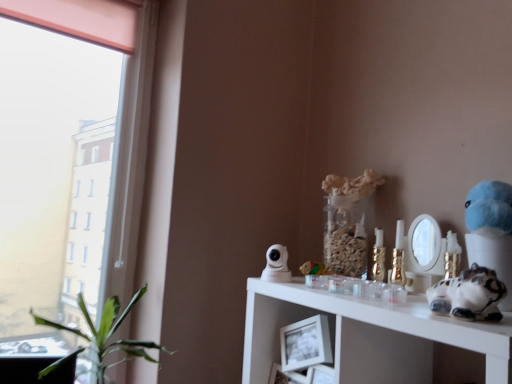
Question: Choose the correct answer: Is white glossy security camera at upper center, marked as the second figurine in a right-to-left arrangement, inside green leafy plant at left or outside it?

Choices:
 (A) outside
 (B) inside

Answer: (A)

Question: From the image's perspective, is white glossy security camera at upper center, which is counted as the 2th figurine, starting from the front, located above or below green leafy plant at left?

Choices:
 (A) below
 (B) above

Answer: (B)

Question: Which object is positioned farthest from the white glossy cat figurine at right, placed as the 1th toy when sorted from right to left?

Choices:
 (A) white glossy cat figurine at right, the 1th figurine when ordered from right to left
 (B) green leafy plant at left
 (C) white glossy security camera at upper center, marked as the first figurine in a back-to-front arrangement
 (D) gold metallic candle holder at upper right
 (E) wooden block at center, which is counted as the 1th toy, starting from the left

Answer: (B)

Question: Which object is the closest to the white glossy cat figurine at right, the second figurine viewed from the left?

Choices:
 (A) white glossy security camera at upper center, which is counted as the 2th figurine, starting from the front
 (B) white glossy cat figurine at right, the 2th toy when ordered from left to right
 (C) wooden block at center, which is the 2th toy in right-to-left order
 (D) green leafy plant at left
 (E) gold metallic candle holder at upper right

Answer: (B)